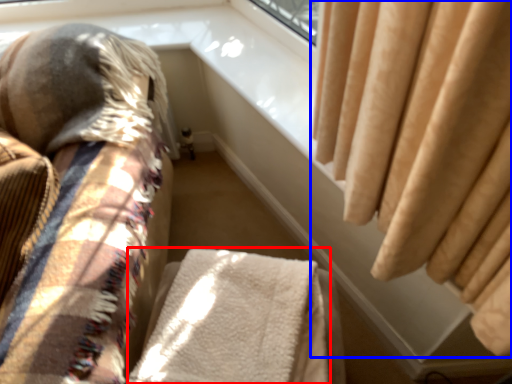
Question: Which point is further to the camera, blanket (highlighted by a red box) or curtain (highlighted by a blue box)?

Choices:
 (A) blanket
 (B) curtain

Answer: (B)